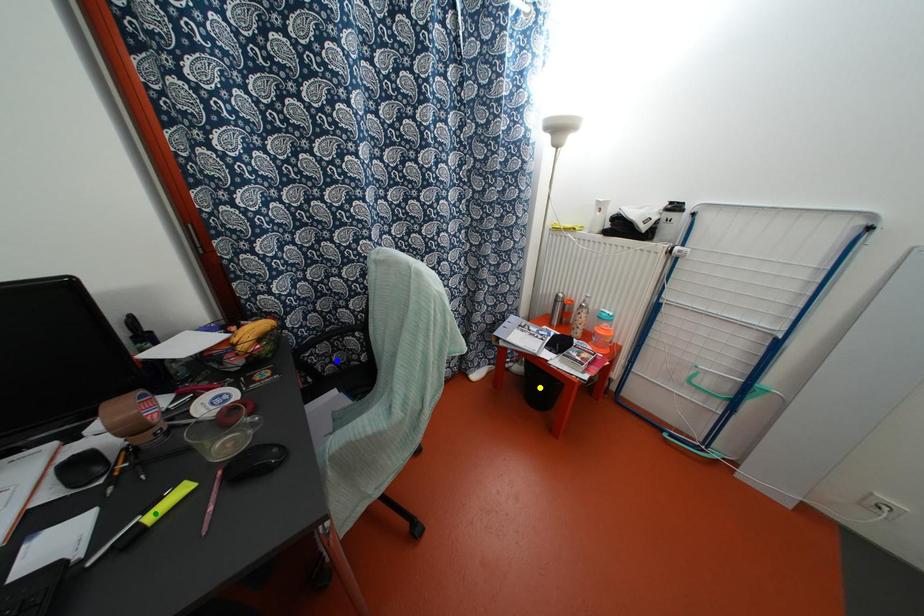
Order these from farthest to nearest:
A) yellow point
B) green point
C) blue point

yellow point, blue point, green point